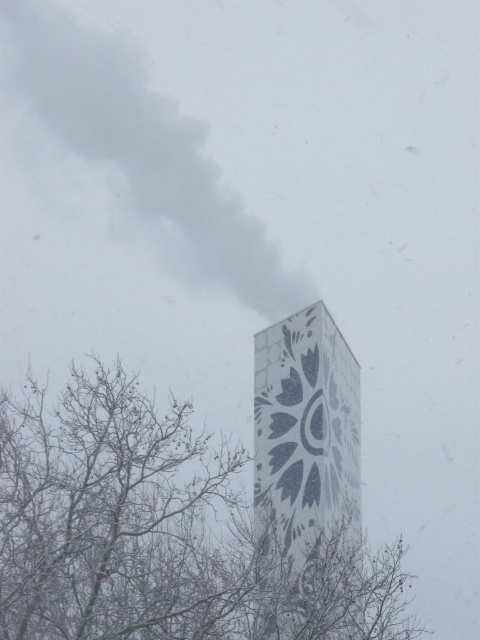
Question: Does bare branches at center appear on the left side of white textured tower at center?

Choices:
 (A) yes
 (B) no

Answer: (A)

Question: Does white textured tower at center appear on the left side of gray smoke at upper center?

Choices:
 (A) no
 (B) yes

Answer: (A)

Question: Can you confirm if bare branches at center is bigger than gray smoke at upper center?

Choices:
 (A) no
 (B) yes

Answer: (B)

Question: Which is nearer to the bare branches at center?

Choices:
 (A) gray smoke at upper center
 (B) white textured tower at center

Answer: (B)

Question: Which object appears farthest from the camera in this image?

Choices:
 (A) bare branches at center
 (B) gray smoke at upper center

Answer: (B)

Question: Which of the following is the farthest from the observer?

Choices:
 (A) bare branches at center
 (B) gray smoke at upper center
 (C) white textured tower at center

Answer: (B)